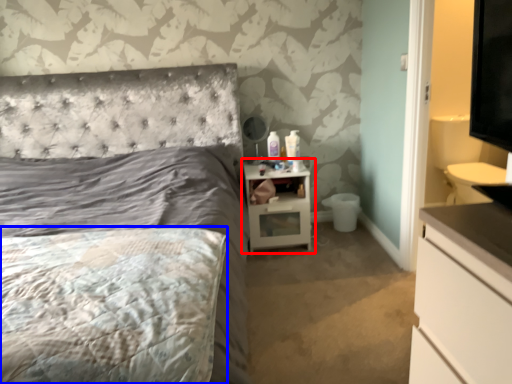
Question: Which of the following is the farthest to the observer, nightstand (highlighted by a red box) or mattress (highlighted by a blue box)?

Choices:
 (A) nightstand
 (B) mattress

Answer: (A)